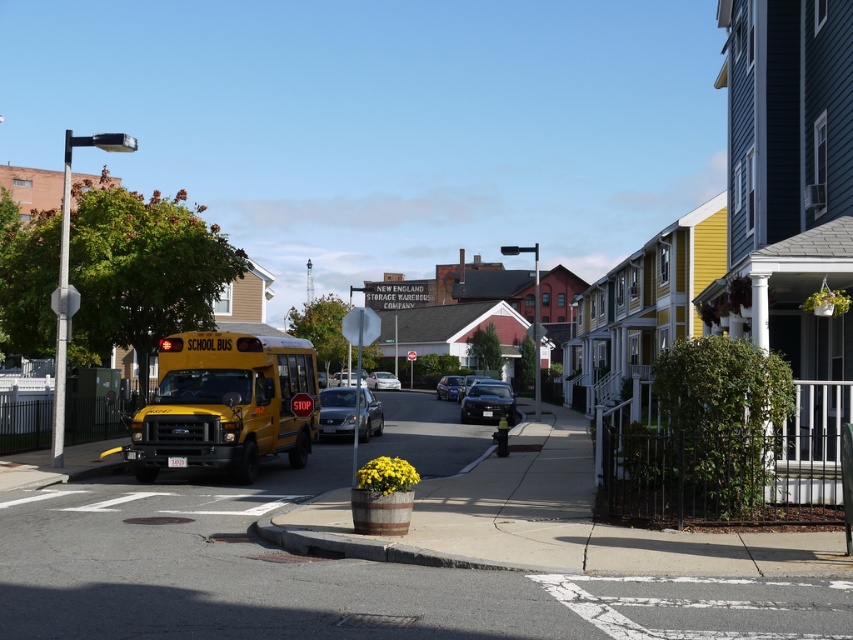
Question: Estimate the real-world distances between objects in this image. Which object is closer to the yellow matte/solid school bus at lower left?

Choices:
 (A) metallic street sign at upper center
 (B) glossy black car at center
 (C) metallic silver sedan at center

Answer: (B)

Question: Does yellow matte/solid school bus at lower left appear over metallic street sign at upper center?

Choices:
 (A) no
 (B) yes

Answer: (A)

Question: Is yellow matte/solid school bus at lower left closer to the viewer compared to white glossy sedan at center?

Choices:
 (A) yes
 (B) no

Answer: (A)

Question: Which point is farther to the camera?

Choices:
 (A) (329, 404)
 (B) (440, 392)
 (C) (151, 412)

Answer: (B)

Question: Does yellow matte/solid school bus at lower left appear on the right side of metallic silver sedan at center?

Choices:
 (A) yes
 (B) no

Answer: (A)

Question: Which point appears farthest from the camera in this image?

Choices:
 (A) (509, 413)
 (B) (322, 428)
 (C) (537, 284)

Answer: (A)